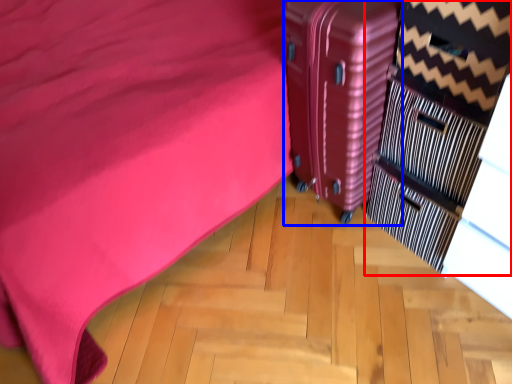
Question: Which object appears farthest to the camera in this image, dresser (highlighted by a red box) or suitcase (highlighted by a blue box)?

Choices:
 (A) dresser
 (B) suitcase

Answer: (B)